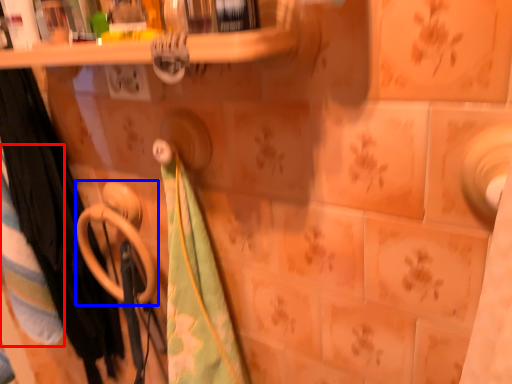
Question: Among these objects, which one is farthest to the camera, beach towel (highlighted by a red box) or towel rack (highlighted by a blue box)?

Choices:
 (A) beach towel
 (B) towel rack

Answer: (A)